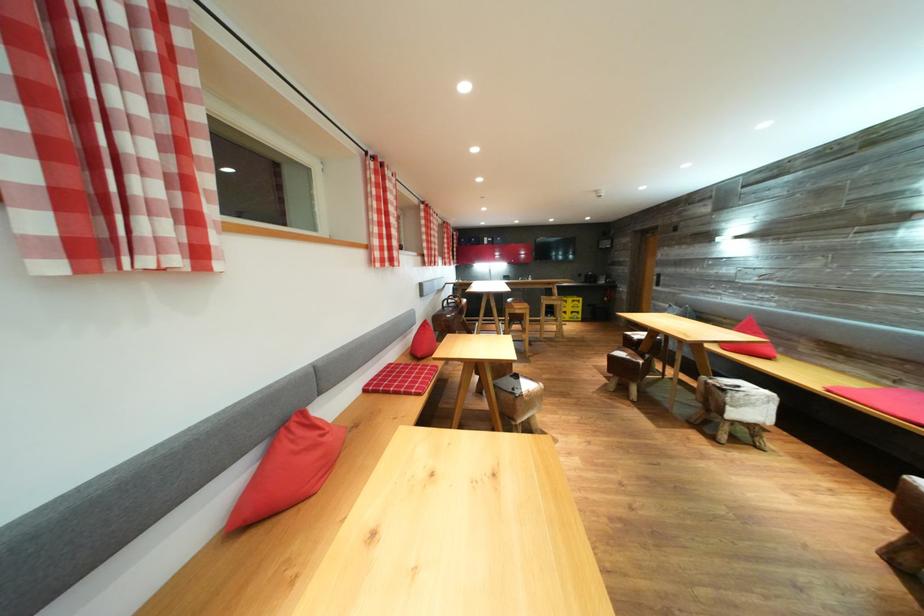
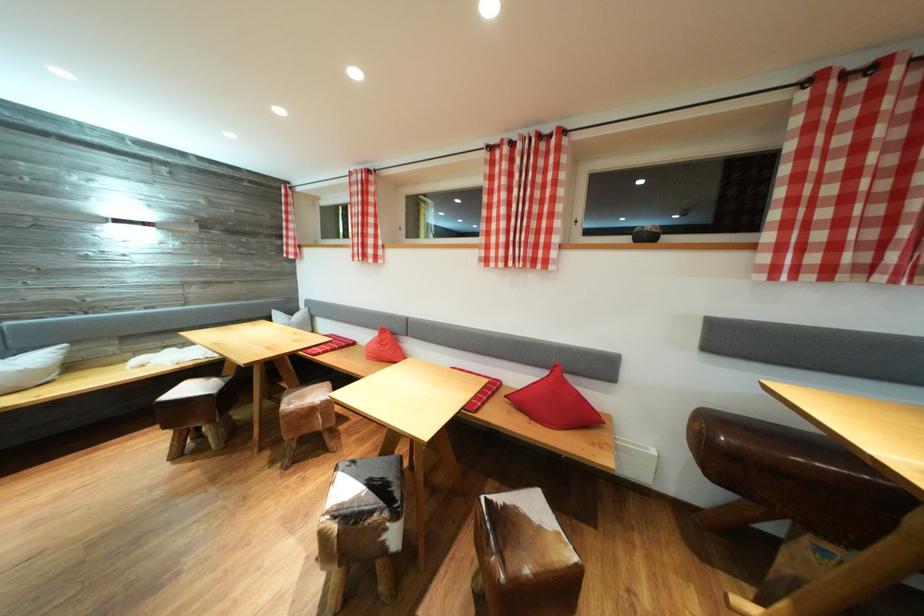
Question: I am providing you with two images of the same scene from different viewpoints. Please identify which objects are invisible in image2.

Choices:
 (A) bar stool sitting surface
 (B) white binder
 (C) small decorative bowl
 (D) pommel horse seat

Answer: (A)